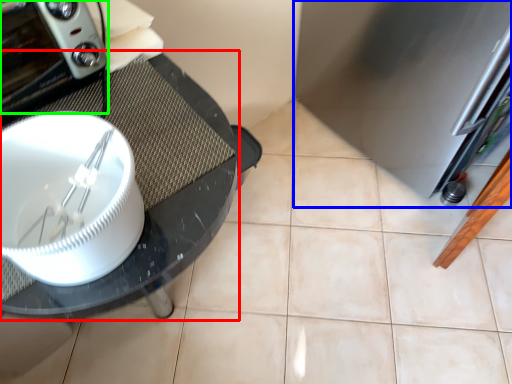
Question: Which object is positioned closest to glass table (highlighted by a red box)? Select from appliance (highlighted by a blue box) and home appliance (highlighted by a green box).

Choices:
 (A) appliance
 (B) home appliance

Answer: (B)